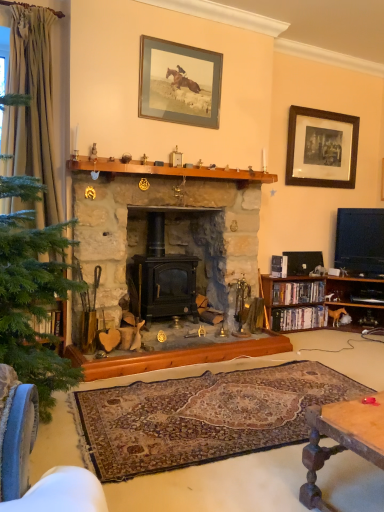
Identify the location of vacant region above black wood picture frame at upper right, which is counted as the second picture frame, starting from the front (from a real-world perspective). The image size is (384, 512). (327, 112).